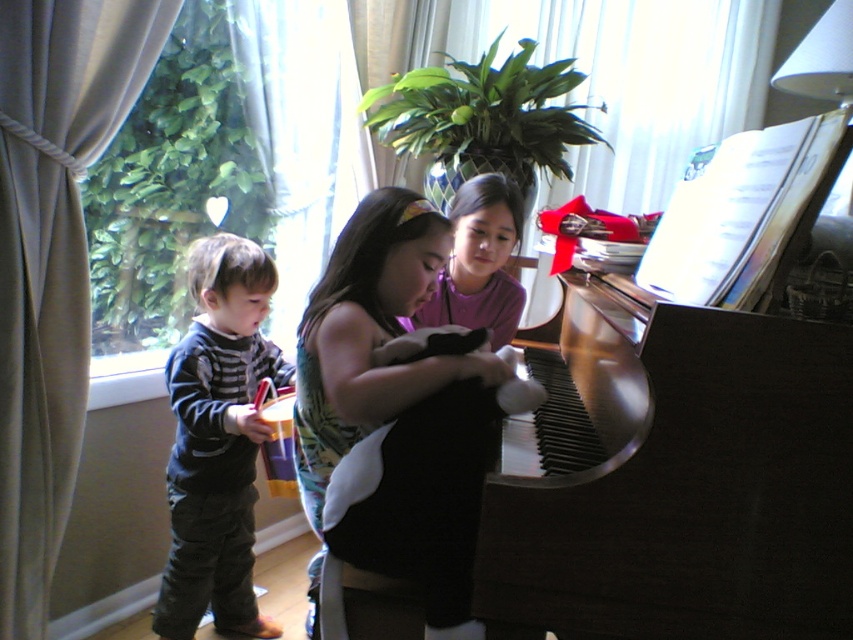
Question: Which point is closer to the camera?

Choices:
 (A) (173, 358)
 (B) (315, 496)
 (C) (462, 220)

Answer: (B)

Question: Does dark blue striped sweater at left have a larger size compared to black fabric dress at center?

Choices:
 (A) yes
 (B) no

Answer: (A)

Question: In this image, where is dark blue striped sweater at left located relative to black fabric dress at center?

Choices:
 (A) above
 (B) below

Answer: (B)

Question: Is dark blue striped sweater at left behind matte purple shirt at center?

Choices:
 (A) no
 (B) yes

Answer: (A)

Question: Which object is positioned farthest from the matte purple shirt at center?

Choices:
 (A) black fabric dress at center
 (B) dark blue striped sweater at left

Answer: (B)

Question: Among these points, which one is farthest from the camera?

Choices:
 (A) (207, 500)
 (B) (372, 237)

Answer: (A)